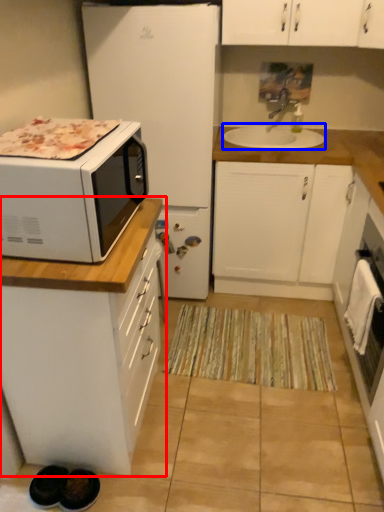
Question: Which of the following is the farthest to the observer, cabinetry (highlighted by a red box) or sink (highlighted by a blue box)?

Choices:
 (A) cabinetry
 (B) sink

Answer: (B)